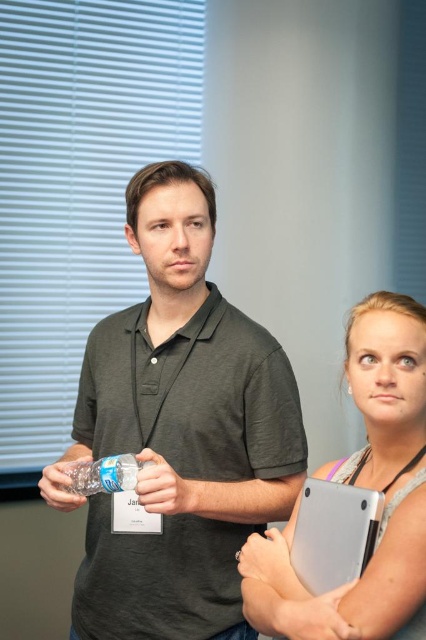
Can you confirm if matte plastic water bottle at center is thinner than translucent plastic cup at lower left?

Indeed, matte plastic water bottle at center has a lesser width compared to translucent plastic cup at lower left.

Find the location of `matte plastic water bottle at center`. matte plastic water bottle at center is located at coordinates (163, 486).

Does point (172, 474) lie behind point (51, 500)?

No.

Locate an element on the screen. Image resolution: width=426 pixels, height=640 pixels. matte plastic water bottle at center is located at coordinates (163, 486).

Does dark green polo shirt at center have a lesser width compared to matte gray tablet at center?

No.

Who is more forward, (267, 371) or (388, 582)?

Positioned in front is point (388, 582).

The height and width of the screenshot is (640, 426). Identify the location of dark green polo shirt at center. (183, 428).

Which is in front, point (405, 320) or point (310, 628)?

Point (310, 628) is more forward.

Is matte gray tablet at center smaller than smooth skin hand at center?

Incorrect, matte gray tablet at center is not smaller in size than smooth skin hand at center.

Is point (281, 589) positioned after point (307, 612)?

Yes.

At what (x,y) coordinates should I click in order to perform the action: click on matte gray tablet at center. Please return your answer as a coordinate pair (x, y). The width and height of the screenshot is (426, 640). Looking at the image, I should click on (362, 486).